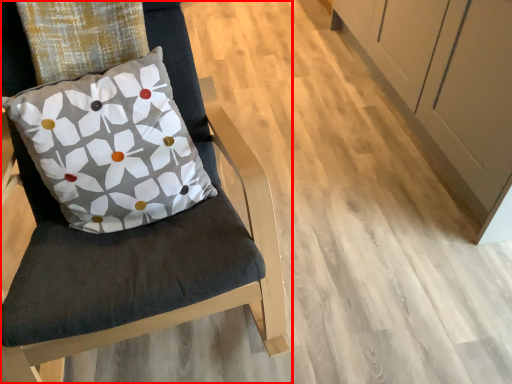
Question: Where is chair (annotated by the red box) located in relation to pillow in the image?

Choices:
 (A) right
 (B) left

Answer: (A)